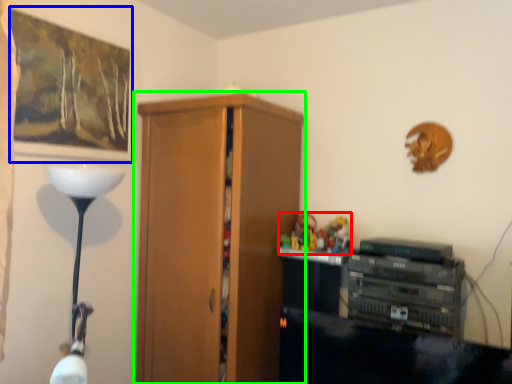
Question: Estimate the real-world distances between objects in this image. Which object is closer to toy (highlighted by a red box), picture frame (highlighted by a blue box) or cupboard (highlighted by a green box)?

Choices:
 (A) picture frame
 (B) cupboard

Answer: (B)